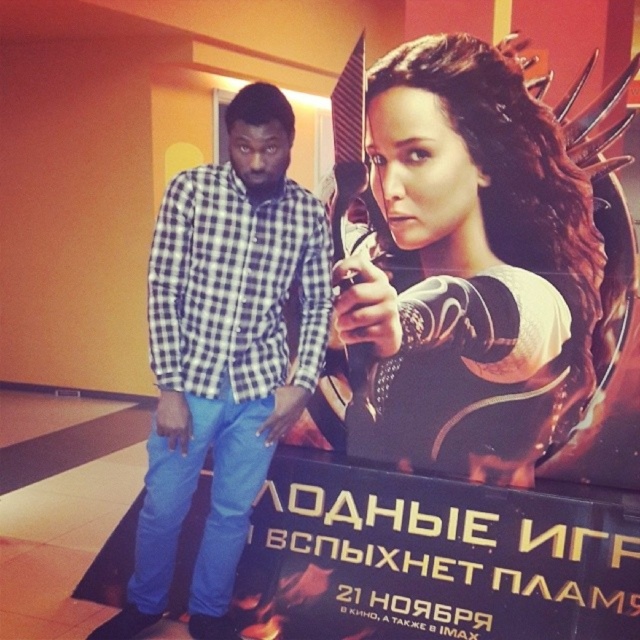
Question: Is shiny black armor at center above checkered fabric shirt at center?

Choices:
 (A) no
 (B) yes

Answer: (B)

Question: Does shiny black armor at center appear on the left side of checkered fabric shirt at center?

Choices:
 (A) yes
 (B) no

Answer: (B)

Question: Which of the following is the farthest from the observer?

Choices:
 (A) (412, 406)
 (B) (248, 260)

Answer: (A)

Question: Which object is farther from the camera taking this photo?

Choices:
 (A) shiny black armor at center
 (B) checkered fabric shirt at center

Answer: (A)

Question: Is shiny black armor at center wider than checkered fabric shirt at center?

Choices:
 (A) no
 (B) yes

Answer: (B)